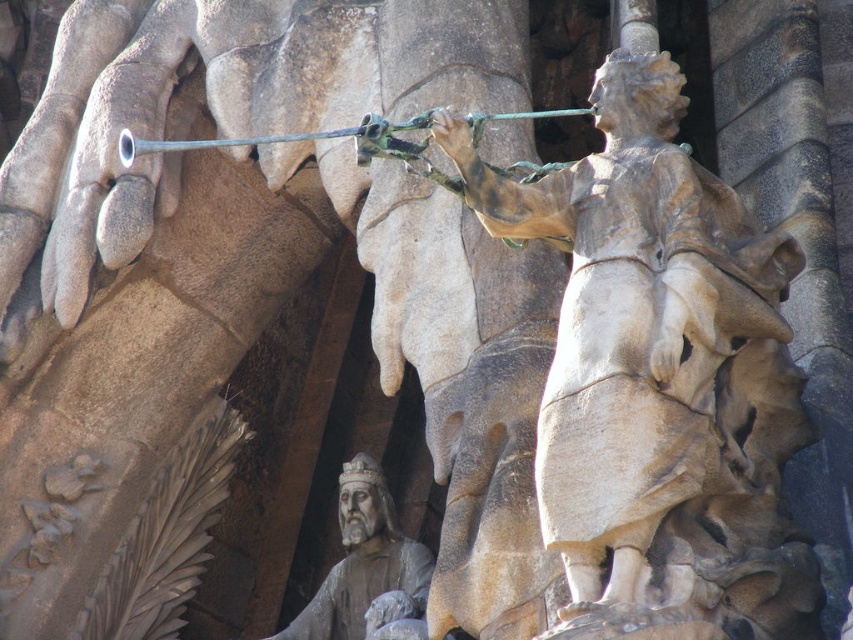
Is stone statue at center to the left of smooth stone statue at lower center from the viewer's perspective?

Incorrect, stone statue at center is not on the left side of smooth stone statue at lower center.

Between point (639, 163) and point (347, 595), which one is positioned behind?

Point (347, 595)

This screenshot has width=853, height=640. Identify the location of stone statue at center. (650, 344).